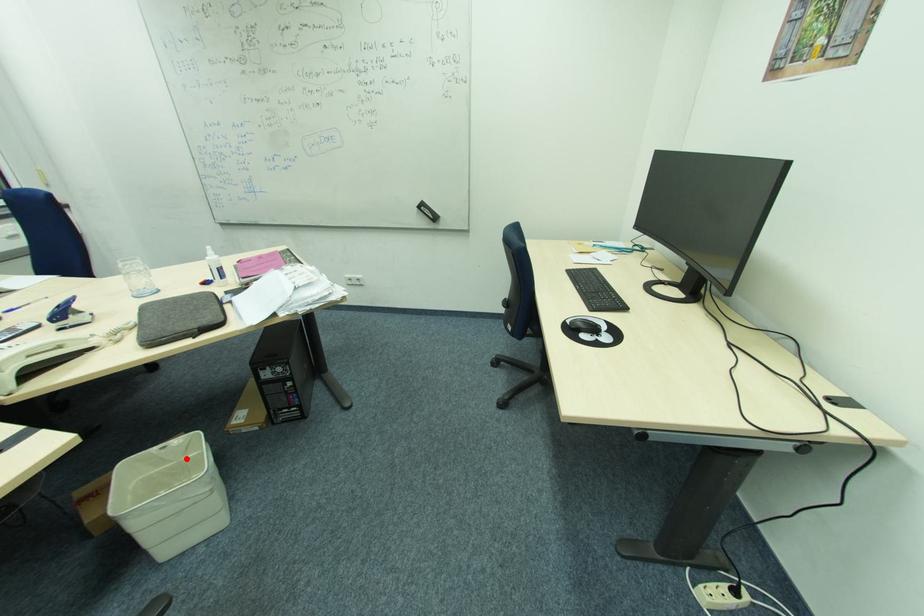
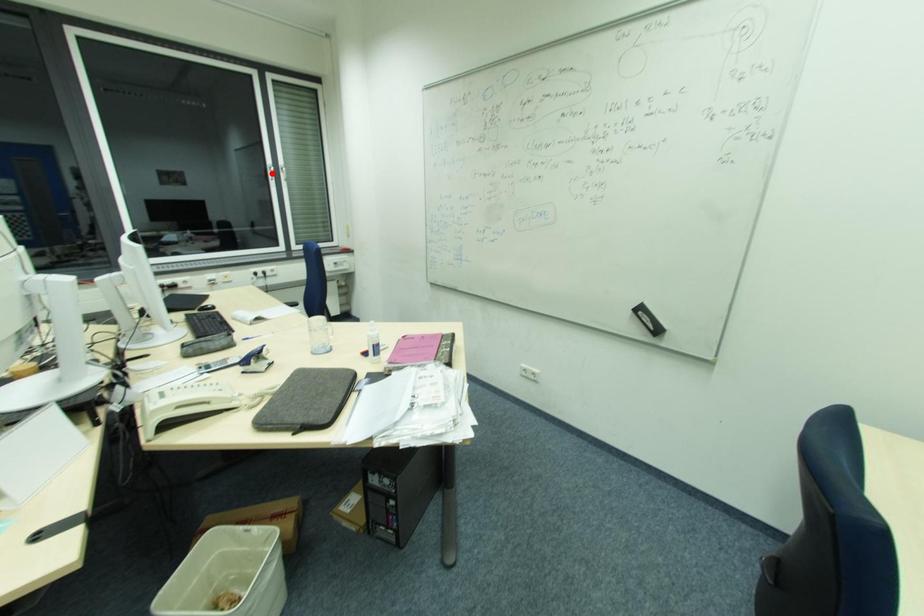
I am providing you with two images of the same scene from different viewpoints. A red point is marked on the first image and another point is marked on the second image. Do the highlighted points in image1 and image2 indicate the same real-world spot?

No